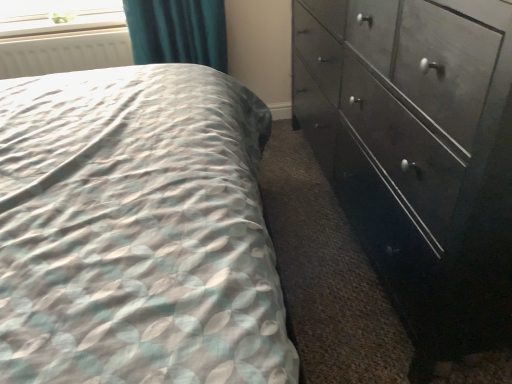
You are a GUI agent. You are given a task and a screenshot of the screen. Output one action in this format:
    pyautogui.click(x=<x>, y=<y>)
    Task: Click on the dark wood dresser at right
    The height and width of the screenshot is (384, 512).
    Given the screenshot: What is the action you would take?
    [419, 152]

This screenshot has width=512, height=384. I want to click on clear plastic window screen at upper left, so click(59, 11).

Locate an element on the screen. dark wood dresser at right is located at coordinates (419, 152).

From the picture: From a real-world perspective, is dark wood dresser at right below clear plastic window screen at upper left?

Correct, in the physical world, dark wood dresser at right is lower than clear plastic window screen at upper left.

From the image's perspective, is dark wood dresser at right positioned above or below clear plastic window screen at upper left?

dark wood dresser at right is situated lower than clear plastic window screen at upper left in the image.

Can you confirm if dark wood dresser at right is smaller than clear plastic window screen at upper left?

No.

This screenshot has width=512, height=384. Find the location of `the chest of drawers located below the clear plastic window screen at upper left (from the image's perspective)`. the chest of drawers located below the clear plastic window screen at upper left (from the image's perspective) is located at coordinates (419, 152).

Is white matte radiator at upper left facing away from clear plastic window screen at upper left?

Yes, white matte radiator at upper left is facing away from clear plastic window screen at upper left.

From a real-world perspective, is white matte radiator at upper left above or below clear plastic window screen at upper left?

white matte radiator at upper left is situated lower than clear plastic window screen at upper left in the real world.

This screenshot has height=384, width=512. I want to click on radiator that is below the clear plastic window screen at upper left (from the image's perspective), so click(65, 53).

Which object is closer to the camera, white matte radiator at upper left or clear plastic window screen at upper left?

white matte radiator at upper left is in front.

From the image's perspective, which is above, dark wood dresser at right or white matte radiator at upper left?

white matte radiator at upper left appears higher in the image.

Considering the relative sizes of dark wood dresser at right and white matte radiator at upper left in the image provided, is dark wood dresser at right thinner than white matte radiator at upper left?

Incorrect, the width of dark wood dresser at right is not less than that of white matte radiator at upper left.

Which object is closer to the camera taking this photo, dark wood dresser at right or white matte radiator at upper left?

dark wood dresser at right is closer to the camera.

From a real-world perspective, between dark wood dresser at right and white matte radiator at upper left, who is vertically higher?

white matte radiator at upper left, from a real-world perspective.

Considering the sizes of objects white matte radiator at upper left and dark wood dresser at right in the image provided, who is thinner, white matte radiator at upper left or dark wood dresser at right?

white matte radiator at upper left.

Is white matte radiator at upper left not near dark wood dresser at right?

Yes.

This screenshot has height=384, width=512. Identify the location of radiator above the dark wood dresser at right (from the image's perspective). (65, 53).

How much distance is there between white matte radiator at upper left and dark wood dresser at right?

1.34 meters.

In the scene shown: Could you measure the distance between clear plastic window screen at upper left and white matte radiator at upper left?

The distance of clear plastic window screen at upper left from white matte radiator at upper left is 4.70 inches.

From the picture: From the image's perspective, between clear plastic window screen at upper left and white matte radiator at upper left, who is located below?

From the image's view, white matte radiator at upper left is below.

Does clear plastic window screen at upper left turn towards white matte radiator at upper left?

Yes, clear plastic window screen at upper left is turned towards white matte radiator at upper left.

Is clear plastic window screen at upper left wider than white matte radiator at upper left?

Correct, the width of clear plastic window screen at upper left exceeds that of white matte radiator at upper left.

Can you tell me how much clear plastic window screen at upper left and dark wood dresser at right differ in facing direction?

89.2 degrees.

Is clear plastic window screen at upper left thinner than dark wood dresser at right?

Correct, the width of clear plastic window screen at upper left is less than that of dark wood dresser at right.

From a real-world perspective, is clear plastic window screen at upper left beneath dark wood dresser at right?

No, from a real-world perspective, clear plastic window screen at upper left is not under dark wood dresser at right.

In order to click on the chest of drawers in front of the clear plastic window screen at upper left in this screenshot , I will do `click(419, 152)`.

Locate an element on the screen. This screenshot has width=512, height=384. window screen located above the white matte radiator at upper left (from a real-world perspective) is located at coordinates (59, 11).

Which object lies nearer to the anchor point white matte radiator at upper left, clear plastic window screen at upper left or dark wood dresser at right?

Among the two, clear plastic window screen at upper left is located nearer to white matte radiator at upper left.

Based on their spatial positions, is clear plastic window screen at upper left or white matte radiator at upper left closer to dark wood dresser at right?

Among the two, white matte radiator at upper left is located nearer to dark wood dresser at right.

Considering their positions, is white matte radiator at upper left positioned closer to clear plastic window screen at upper left than dark wood dresser at right?

white matte radiator at upper left is positioned closer to the anchor clear plastic window screen at upper left.

Which object lies nearer to the anchor point dark wood dresser at right, white matte radiator at upper left or clear plastic window screen at upper left?

white matte radiator at upper left.

From the image, which object appears to be farther from white matte radiator at upper left, dark wood dresser at right or clear plastic window screen at upper left?

The object further to white matte radiator at upper left is dark wood dresser at right.

Estimate the real-world distances between objects in this image. Which object is further from clear plastic window screen at upper left, dark wood dresser at right or white matte radiator at upper left?

Among the two, dark wood dresser at right is located further to clear plastic window screen at upper left.

The width and height of the screenshot is (512, 384). I want to click on radiator located between clear plastic window screen at upper left and dark wood dresser at right in the left-right direction, so click(65, 53).